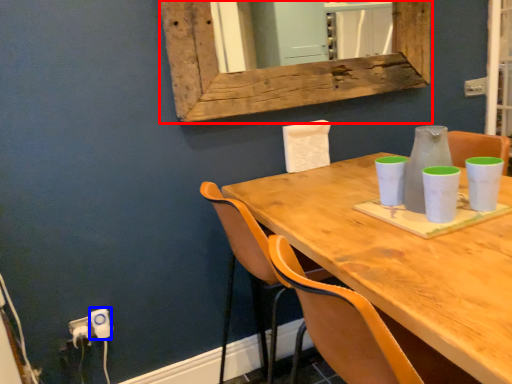
Question: Among these objects, which one is nearest to the camera, window frame (highlighted by a red box) or electric outlet (highlighted by a blue box)?

Choices:
 (A) window frame
 (B) electric outlet

Answer: (A)